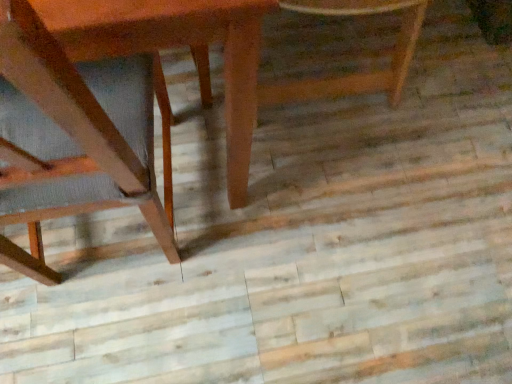
Image resolution: width=512 pixels, height=384 pixels. Find the location of `wooden chair at left, placed as the second chair when sorted from right to left`. wooden chair at left, placed as the second chair when sorted from right to left is located at coordinates (75, 137).

Measure the distance between point (97,46) and camera.

49.30 centimeters.

What do you see at coordinates (170, 47) in the screenshot? I see `wooden table at left` at bounding box center [170, 47].

Find the location of a particular element. The image size is (512, 384). wooden chair at center, the 1th chair when ordered from right to left is located at coordinates (354, 74).

Considering the relative positions of wooden chair at left, which is the first chair from left to right, and wooden chair at center, the 2th chair positioned from the left, in the image provided, is wooden chair at left, which is the first chair from left to right, in front of wooden chair at center, the 2th chair positioned from the left,?

Yes, wooden chair at left, which is the first chair from left to right, is closer to the camera.

From a real-world perspective, between wooden chair at left, which is the first chair from left to right, and wooden chair at center, the 2th chair positioned from the left, who is vertically lower?

wooden chair at center, the 2th chair positioned from the left, from a real-world perspective.

From the image's perspective, which is below, wooden chair at left, placed as the second chair when sorted from right to left, or wooden chair at center, the 2th chair positioned from the left?

From the image's view, wooden chair at left, placed as the second chair when sorted from right to left, is below.

Which of these two, wooden chair at left, placed as the second chair when sorted from right to left, or wooden chair at center, the 2th chair positioned from the left, is bigger?

With larger size is wooden chair at left, placed as the second chair when sorted from right to left.

Considering the relative sizes of wooden chair at center, the 2th chair positioned from the left, and wooden table at left in the image provided, is wooden chair at center, the 2th chair positioned from the left, thinner than wooden table at left?

Yes, wooden chair at center, the 2th chair positioned from the left, is thinner than wooden table at left.

Considering the sizes of wooden chair at center, the 2th chair positioned from the left, and wooden table at left in the image, is wooden chair at center, the 2th chair positioned from the left, taller or shorter than wooden table at left?

Clearly, wooden chair at center, the 2th chair positioned from the left, is shorter compared to wooden table at left.

The image size is (512, 384). I want to click on round table above the wooden chair at center, the 1th chair when ordered from right to left (from a real-world perspective), so click(x=170, y=47).

Is wooden table at left facing away from wooden chair at center, the 2th chair positioned from the left?

wooden table at left does not have its back to wooden chair at center, the 2th chair positioned from the left.

Considering the sizes of objects wooden table at left and wooden chair at center, the 1th chair when ordered from right to left, in the image provided, who is shorter, wooden table at left or wooden chair at center, the 1th chair when ordered from right to left,?

wooden chair at center, the 1th chair when ordered from right to left.

From a real-world perspective, which object stands above the other?

In real-world perspective, wooden table at left is above.

Can you confirm if wooden table at left is positioned to the left of wooden chair at center, the 2th chair positioned from the left?

Yes.

Based on the photo, can you confirm if wooden table at left is positioned to the left of wooden chair at left, which is the first chair from left to right?

Yes.

Looking at this image, is wooden table at left oriented towards wooden chair at left, placed as the second chair when sorted from right to left?

Yes.

From the image's perspective, is wooden table at left positioned above or below wooden chair at left, placed as the second chair when sorted from right to left?

wooden table at left is above wooden chair at left, placed as the second chair when sorted from right to left.

How distant is wooden table at left from wooden chair at left, placed as the second chair when sorted from right to left?

A: wooden table at left is 13.40 centimeters from wooden chair at left, placed as the second chair when sorted from right to left.

Does wooden chair at left, placed as the second chair when sorted from right to left, have a larger size compared to wooden table at left?

Actually, wooden chair at left, placed as the second chair when sorted from right to left, might be smaller than wooden table at left.

From a real-world perspective, which object rests below the other?

wooden table at left.

This screenshot has width=512, height=384. What are the coordinates of `chair in front of the wooden table at left` in the screenshot? It's located at (75, 137).

Between wooden chair at center, the 1th chair when ordered from right to left, and wooden chair at left, placed as the second chair when sorted from right to left, which one has less height?

Standing shorter between the two is wooden chair at center, the 1th chair when ordered from right to left.

Can you confirm if wooden chair at center, the 2th chair positioned from the left, is bigger than wooden chair at left, which is the first chair from left to right?

No.

You are a GUI agent. You are given a task and a screenshot of the screen. Output one action in this format:
    pyautogui.click(x=<x>, y=<y>)
    Task: Click on the chair lying above the wooden chair at left, which is the first chair from left to right (from the image's perspective)
    This screenshot has width=512, height=384.
    Given the screenshot: What is the action you would take?
    pyautogui.click(x=354, y=74)

In order to click on chair behind the wooden table at left in this screenshot , I will do `click(354, 74)`.

From the image, which object appears to be nearer to wooden chair at left, which is the first chair from left to right, wooden chair at center, the 1th chair when ordered from right to left, or wooden table at left?

wooden table at left is closer to wooden chair at left, which is the first chair from left to right.

When comparing their distances from wooden chair at left, placed as the second chair when sorted from right to left, does wooden table at left or wooden chair at center, the 1th chair when ordered from right to left, seem further?

wooden chair at center, the 1th chair when ordered from right to left, is positioned further to the anchor wooden chair at left, placed as the second chair when sorted from right to left.

From the image, which object appears to be nearer to wooden table at left, wooden chair at left, which is the first chair from left to right, or wooden chair at center, the 1th chair when ordered from right to left?

Among the two, wooden chair at left, which is the first chair from left to right, is located nearer to wooden table at left.

When comparing their distances from wooden table at left, does wooden chair at center, the 2th chair positioned from the left, or wooden chair at left, placed as the second chair when sorted from right to left, seem closer?

The object closer to wooden table at left is wooden chair at left, placed as the second chair when sorted from right to left.

From the image, which object appears to be nearer to wooden chair at center, the 1th chair when ordered from right to left, wooden table at left or wooden chair at left, placed as the second chair when sorted from right to left?

The object closer to wooden chair at center, the 1th chair when ordered from right to left, is wooden table at left.

Based on their spatial positions, is wooden chair at left, placed as the second chair when sorted from right to left, or wooden table at left closer to wooden chair at center, the 2th chair positioned from the left?

Based on the image, wooden table at left appears to be nearer to wooden chair at center, the 2th chair positioned from the left.

The height and width of the screenshot is (384, 512). In order to click on chair between wooden table at left and wooden chair at center, the 2th chair positioned from the left in this screenshot , I will do `click(75, 137)`.